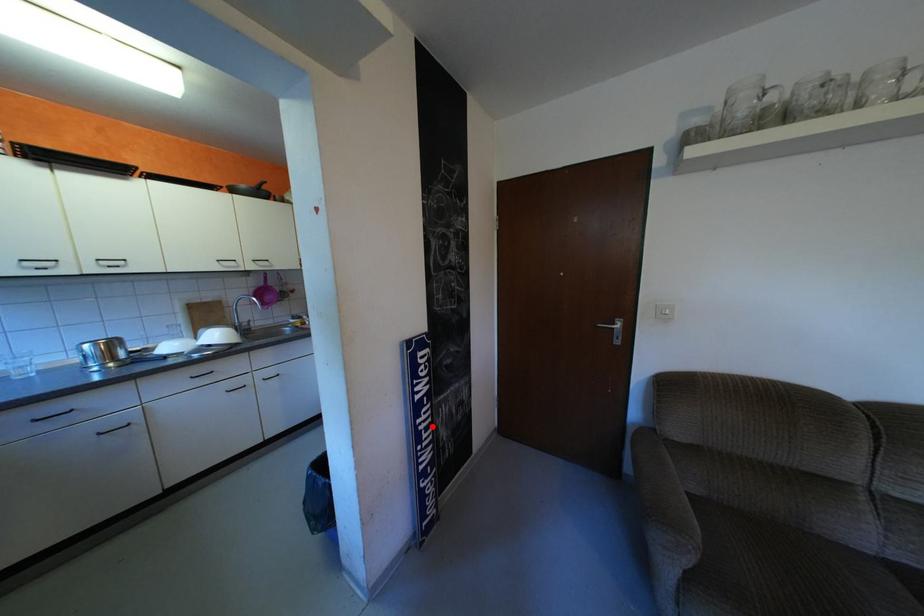
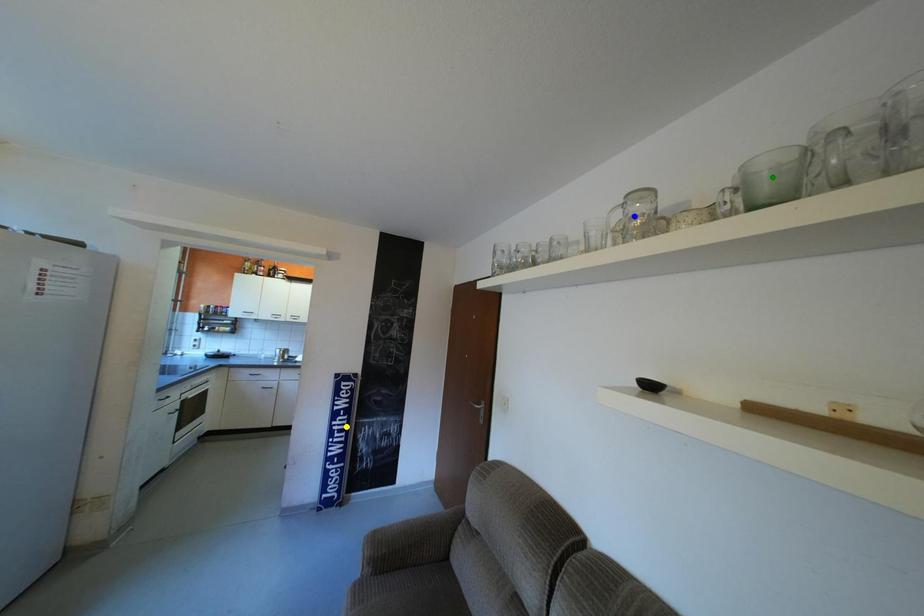
Question: I am providing you with two images of the same scene from different viewpoints. A red point is marked on the first image. You are given multiple points on the second image. Which point in image 2 represents the same 3d spot as the red point in image 1?

Choices:
 (A) yellow point
 (B) blue point
 (C) green point

Answer: (A)